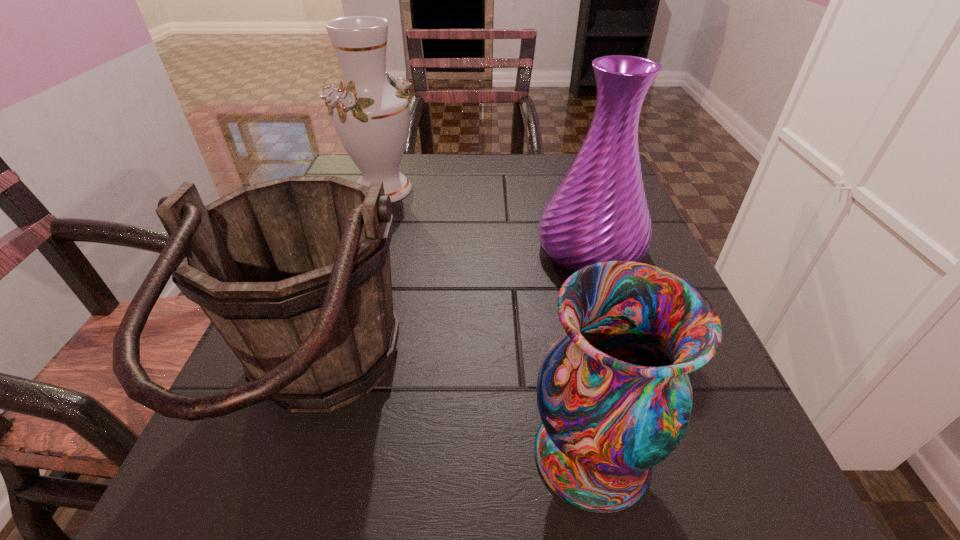
I want to click on the leftmost vase, so click(x=371, y=116).

Locate an element on the screen. Image resolution: width=960 pixels, height=540 pixels. the farthest vase is located at coordinates coord(371,116).

Where is `the second farthest object`? the second farthest object is located at coordinates (599, 212).

Locate an element on the screen. This screenshot has width=960, height=540. bucket is located at coordinates (294, 273).

Where is `the shortest vase`? Image resolution: width=960 pixels, height=540 pixels. the shortest vase is located at coordinates (613, 394).

This screenshot has width=960, height=540. What are the coordinates of `free spot located 0.240m on the right of the farthest object` in the screenshot? It's located at (522, 190).

I want to click on free space located on the left of the third nearest object, so click(388, 249).

At what (x,y) coordinates should I click in order to perform the action: click on vacant area situated 0.250m on the handle side of the bucket. Please return your answer as a coordinate pair (x, y). Looking at the image, I should click on coord(586,390).

The width and height of the screenshot is (960, 540). I want to click on vacant space located 0.100m on the back of the nearest vase, so (x=569, y=344).

The image size is (960, 540). Identify the location of object that is at the far edge. (371, 116).